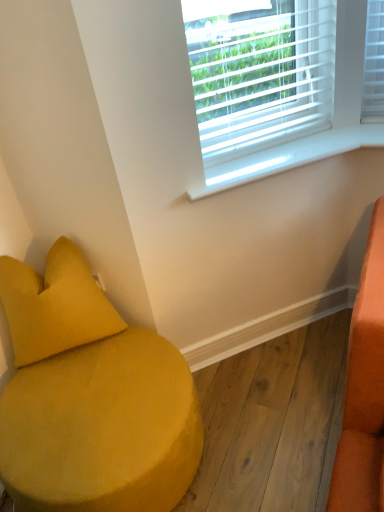
This screenshot has width=384, height=512. What are the coordinates of `free spot above white plastic window sill at upper center (from a real-world perspective)` in the screenshot? It's located at (249, 155).